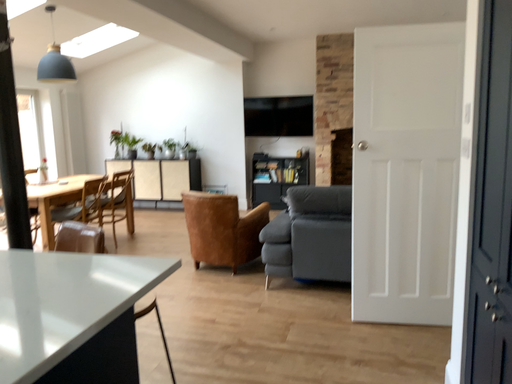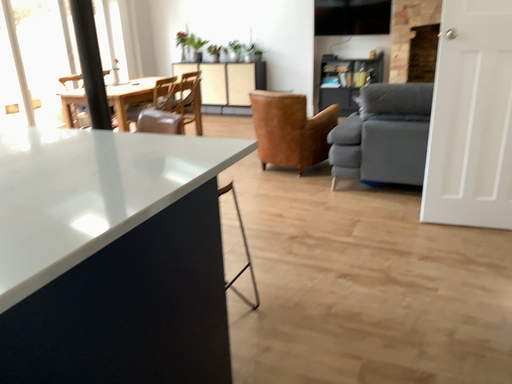
Question: How did the camera likely rotate when shooting the video?

Choices:
 (A) rotated left
 (B) rotated right

Answer: (A)